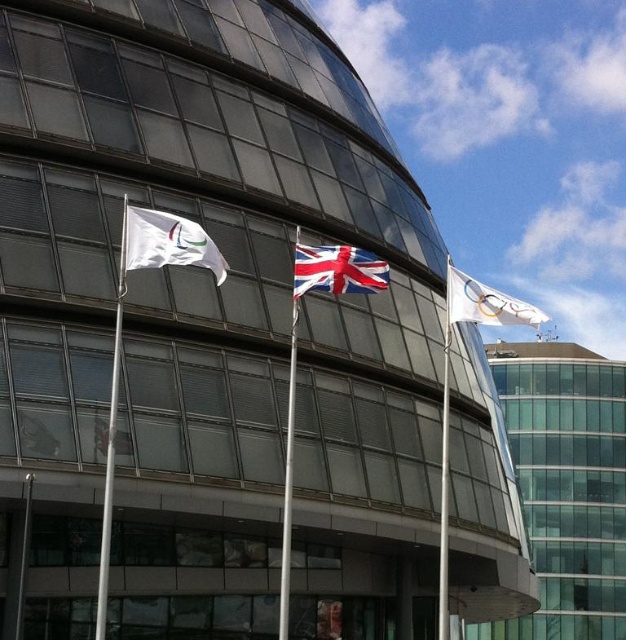
You are a photographer planning to take a photo of the white plastic flag pole at left and the white metallic flag pole at center in front of the modern glass building. If you want to include both flags in the same frame, which flag pole should you position closer to the camera to ensure both are fully visible?

To include both the white plastic flag pole at left and the white metallic flag pole at center in the same frame, you should position the white plastic flag pole at left closer to the camera since it is shorter than the white metallic flag pole at center. This way, the shorter flag pole will not be obscured by the taller one when viewed from the camera angle.

You are standing at the entrance of the modern glass building and want to walk towards the point marked as point (x=207, y=244). However, there is an obstacle at point (x=351, y=264). Will you encounter the obstacle before reaching your destination?

Point (x=207, y=244) is in front of point (x=351, y=264), so you will reach the destination before encountering the obstacle.